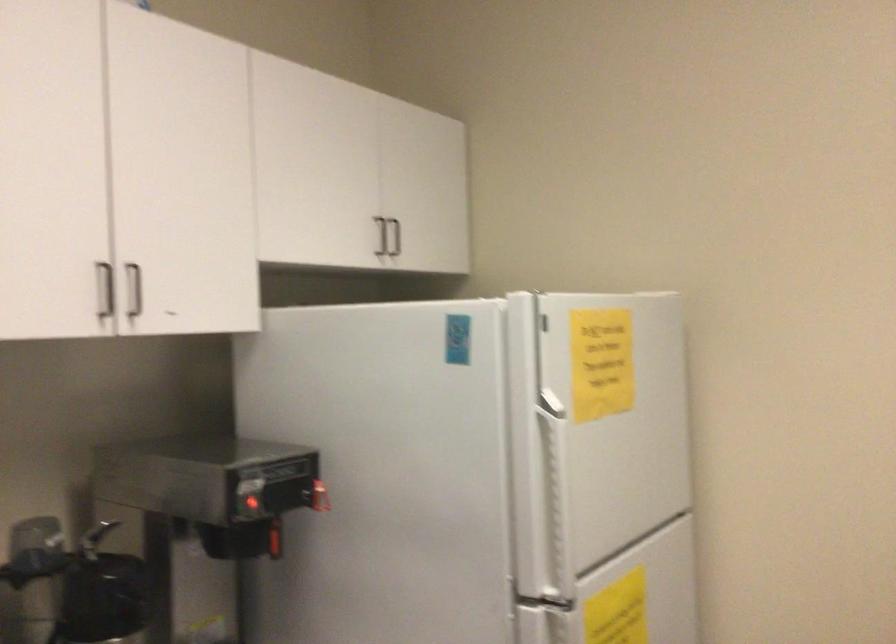
Locate an element on the screen. This screenshot has height=644, width=896. red illuminated switch is located at coordinates (250, 504).